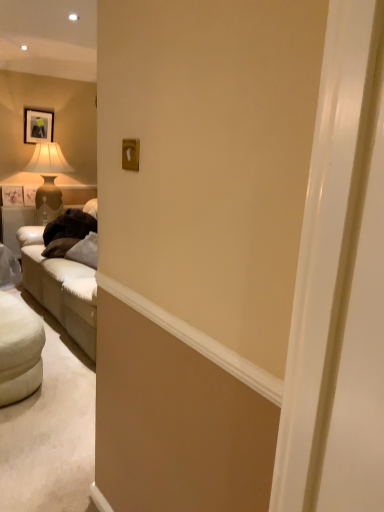
Question: Does matte beige lampshade at left lie behind white fabric ottoman at lower left?

Choices:
 (A) no
 (B) yes

Answer: (B)

Question: Is matte beige lampshade at left to the right of white fabric ottoman at lower left from the viewer's perspective?

Choices:
 (A) no
 (B) yes

Answer: (A)

Question: From the image's perspective, is matte beige lampshade at left over white fabric ottoman at lower left?

Choices:
 (A) yes
 (B) no

Answer: (A)

Question: Can you see matte beige lampshade at left touching white fabric ottoman at lower left?

Choices:
 (A) yes
 (B) no

Answer: (B)

Question: Can you confirm if matte beige lampshade at left is shorter than white fabric ottoman at lower left?

Choices:
 (A) yes
 (B) no

Answer: (B)

Question: From a real-world perspective, is white fabric ottoman at lower left physically located above or below matte beige lampshade at left?

Choices:
 (A) above
 (B) below

Answer: (B)

Question: From the image's perspective, is white fabric ottoman at lower left located above or below matte beige lampshade at left?

Choices:
 (A) above
 (B) below

Answer: (B)

Question: Is white fabric ottoman at lower left situated inside matte beige lampshade at left or outside?

Choices:
 (A) inside
 (B) outside

Answer: (B)

Question: From their relative heights in the image, would you say white fabric ottoman at lower left is taller or shorter than matte beige lampshade at left?

Choices:
 (A) short
 (B) tall

Answer: (A)

Question: From a real-world perspective, is matte black picture frame at upper left positioned above or below matte beige lampshade at left?

Choices:
 (A) below
 (B) above

Answer: (B)

Question: From the image's perspective, is matte black picture frame at upper left above or below matte beige lampshade at left?

Choices:
 (A) above
 (B) below

Answer: (A)

Question: Considering the positions of matte black picture frame at upper left and matte beige lampshade at left in the image, is matte black picture frame at upper left wider or thinner than matte beige lampshade at left?

Choices:
 (A) wide
 (B) thin

Answer: (B)

Question: Is matte black picture frame at upper left taller or shorter than matte beige lampshade at left?

Choices:
 (A) short
 (B) tall

Answer: (A)

Question: Considering the positions of point (56, 144) and point (16, 321), is point (56, 144) closer or farther from the camera than point (16, 321)?

Choices:
 (A) closer
 (B) farther

Answer: (B)

Question: From a real-world perspective, is matte beige lampshade at left above or below white fabric ottoman at lower left?

Choices:
 (A) above
 (B) below

Answer: (A)